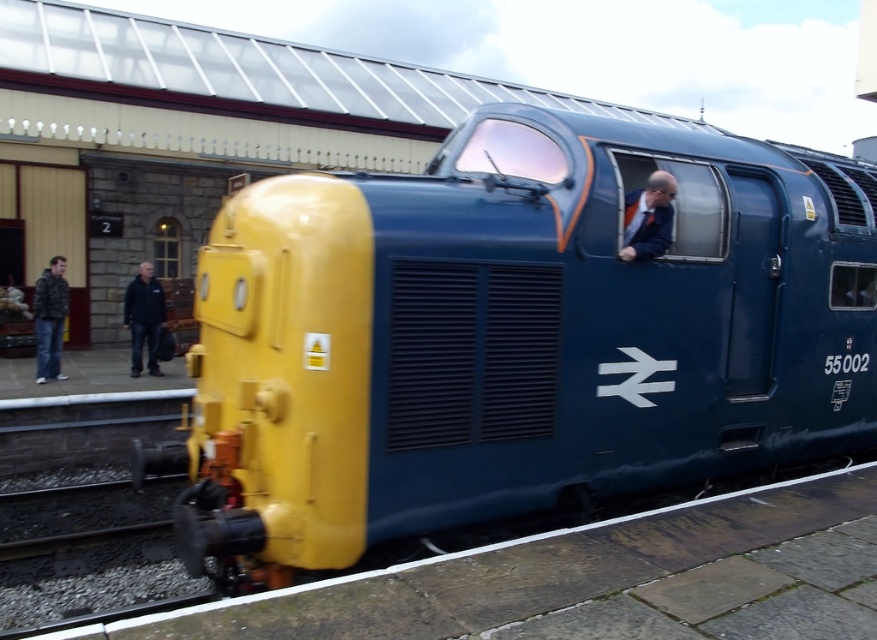
You are standing on the platform at the railway station and see the matte blue train at center and the matte blue suit at center. Which object is located to the left?

The matte blue train at center is positioned on the left side of the matte blue suit at center, so the matte blue train at center is located to the left.

You are a passenger waiting on the platform. You see the matte blue train at center and the dark gray jacket at left. Which object is closer to you?

The matte blue train at center is closer to you because it is in front of the dark gray jacket at left.